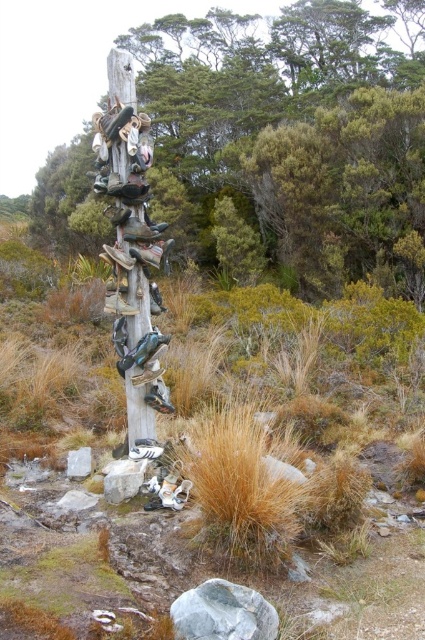
Can you confirm if white marble stone at center is shorter than matte black shoe at center?

Indeed, white marble stone at center has a lesser height compared to matte black shoe at center.

The image size is (425, 640). Describe the element at coordinates (79, 464) in the screenshot. I see `white marble stone at center` at that location.

You are a GUI agent. You are given a task and a screenshot of the screen. Output one action in this format:
    pyautogui.click(x=<x>, y=<y>)
    Task: Click on the white marble stone at center
    Image resolution: width=425 pixels, height=640 pixels.
    Given the screenshot: What is the action you would take?
    pyautogui.click(x=79, y=464)

Is gray rock at center positioned at the back of matte black shoe at center?

No, it is in front of matte black shoe at center.

Is gray rock at center smaller than matte black shoe at center?

No, gray rock at center is not smaller than matte black shoe at center.

Measure the distance between point (200,625) and camera.

Point (200,625) and camera are 2.86 meters apart from each other.

At what (x,y) coordinates should I click in order to perform the action: click on gray rock at center. Please return your answer as a coordinate pair (x, y). The width and height of the screenshot is (425, 640). Looking at the image, I should click on (223, 612).

Between shiny metallic shoes at center and shiny black shoe at center, which one appears on the left side from the viewer's perspective?

shiny metallic shoes at center is more to the left.

Who is shorter, shiny metallic shoes at center or shiny black shoe at center?

With less height is shiny black shoe at center.

The width and height of the screenshot is (425, 640). I want to click on shiny metallic shoes at center, so tap(130, 250).

You are a GUI agent. You are given a task and a screenshot of the screen. Output one action in this format:
    pyautogui.click(x=<x>, y=<y>)
    Task: Click on the shiny metallic shoes at center
    The image size is (425, 640).
    Given the screenshot: What is the action you would take?
    pyautogui.click(x=130, y=250)